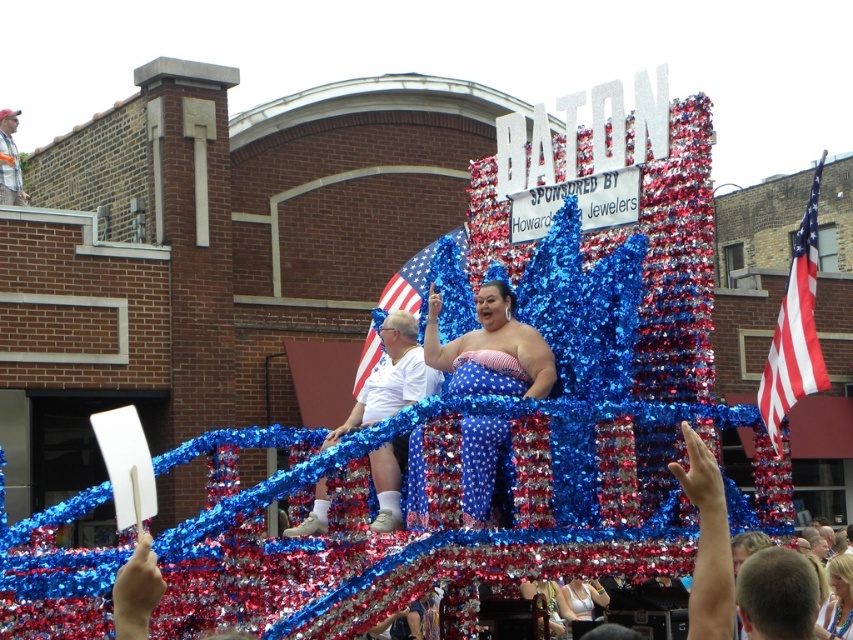
Does white matte t-shirt at center have a lesser width compared to american flag at center?

Yes.

Is white matte t-shirt at center below american flag at center?

Correct, white matte t-shirt at center is located below american flag at center.

At what (x,y) coordinates should I click in order to perform the action: click on white matte t-shirt at center. Please return your answer as a coordinate pair (x, y). This screenshot has height=640, width=853. Looking at the image, I should click on (392, 378).

Where is `white matte t-shirt at center`? white matte t-shirt at center is located at coordinates (392, 378).

Between red-white-blue fabric flag at right and blonde hair at upper center, which one has more height?

red-white-blue fabric flag at right

Can you confirm if red-white-blue fabric flag at right is taller than blonde hair at upper center?

Yes, red-white-blue fabric flag at right is taller than blonde hair at upper center.

Does point (799, 378) lie in front of point (844, 604)?

That is True.

Find the location of a particular element. The image size is (853, 640). red-white-blue fabric flag at right is located at coordinates (795, 330).

Who is more distant from viewer, (491,288) or (834,568)?

Positioned behind is point (834,568).

Is point (466, 458) farther from camera compared to point (831, 634)?

No, it is not.

This screenshot has height=640, width=853. Identify the location of shiny metallic dress at center. (491, 348).